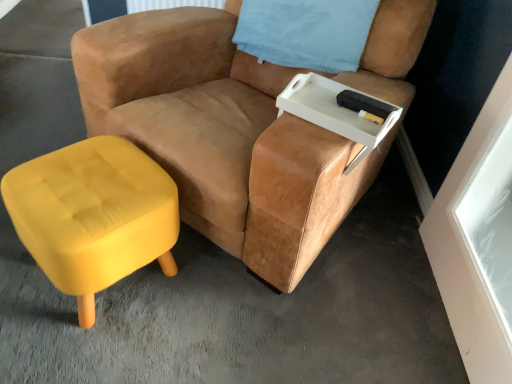
Where is `free space to the right of velvet yellow ottoman at lower left`? The image size is (512, 384). free space to the right of velvet yellow ottoman at lower left is located at coordinates 204,304.